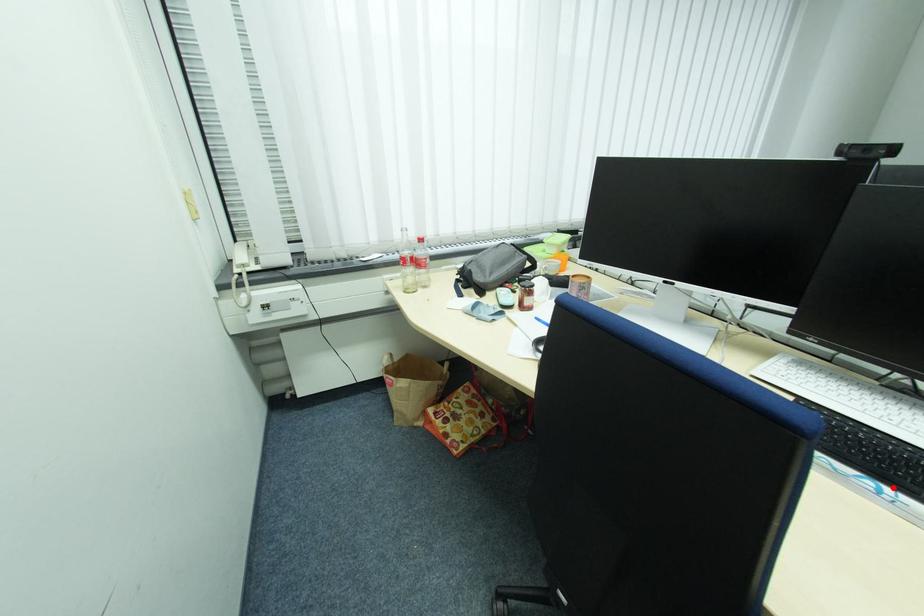
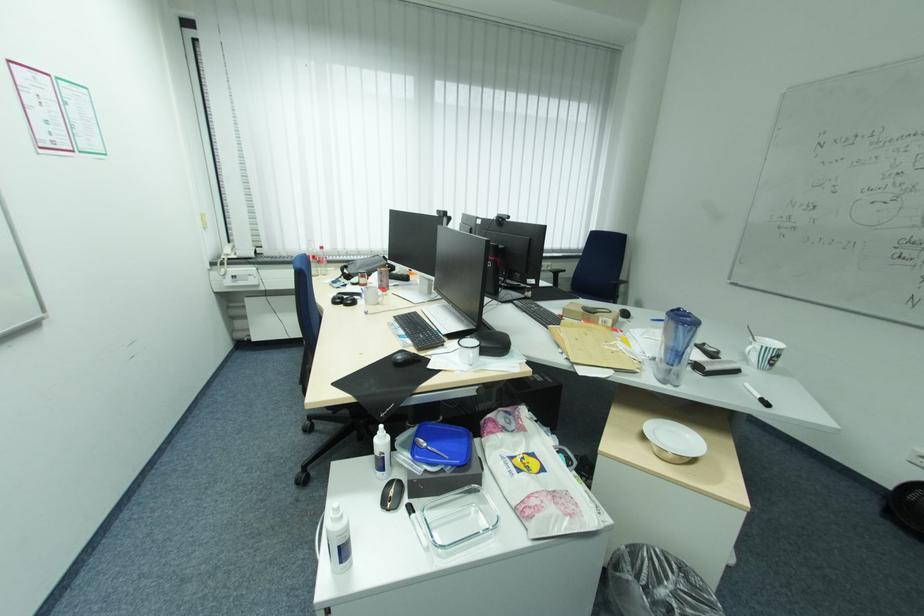
Find the pixel in the second image that matches the highlighted location in the first image.

(407, 329)